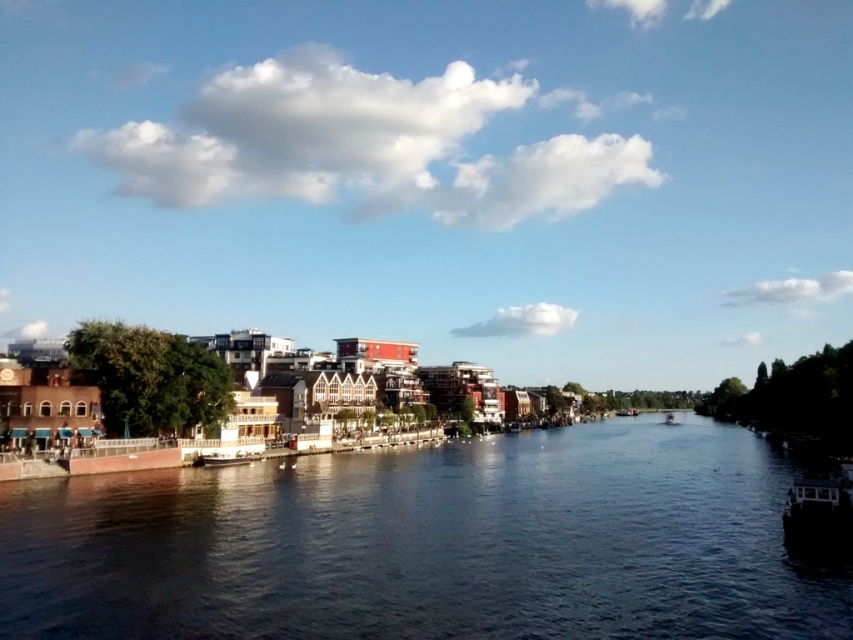
You are standing on the walkway next to the river and see two points marked in the image. One is labeled as point (x=370, y=472) and the other as point (x=817, y=522). Which point is closer to you?

Point (x=817, y=522) is closer to you because point (x=370, y=472) is behind it.

You are a photographer planning to capture the white plastic boat at center and the dark blue water at center in a single frame. Based on their sizes, which object should you focus on to ensure both are clearly visible in your photo?

The dark blue water at center is smaller than the white plastic boat at center, so focusing on the white plastic boat at center will help ensure both objects are clearly visible in the photo.

You are standing on the walkway next to the river and want to take a photo of the dark blue water at center. Where should you position yourself to capture the water in the center of your camera view?

You should position yourself directly in front of the dark blue water at center, which is located at coordinates point (428, 545), to ensure it appears centered in your camera view.